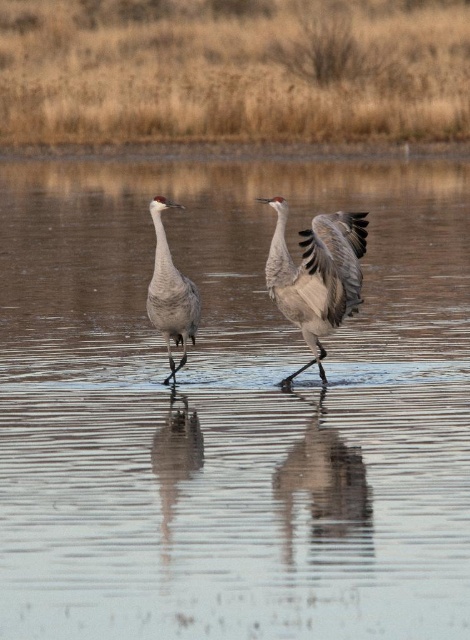
Question: Based on their relative distances, which object is farther from the brown grass at upper center?

Choices:
 (A) gray matte goose at center
 (B) gray feathered crane at center

Answer: (A)

Question: Which of the following is the closest to the observer?

Choices:
 (A) gray feathered crane at center
 (B) gray matte goose at center

Answer: (A)

Question: From the image, what is the correct spatial relationship of gray feathered crane at center in relation to gray matte goose at center?

Choices:
 (A) below
 (B) above

Answer: (B)

Question: Can you confirm if brown grass at upper center is thinner than gray feathered crane at center?

Choices:
 (A) yes
 (B) no

Answer: (B)

Question: Which point appears closest to the camera in this image?

Choices:
 (A) (156, 250)
 (B) (322, 278)

Answer: (B)

Question: Does brown grass at upper center appear on the right side of gray matte goose at center?

Choices:
 (A) yes
 (B) no

Answer: (B)